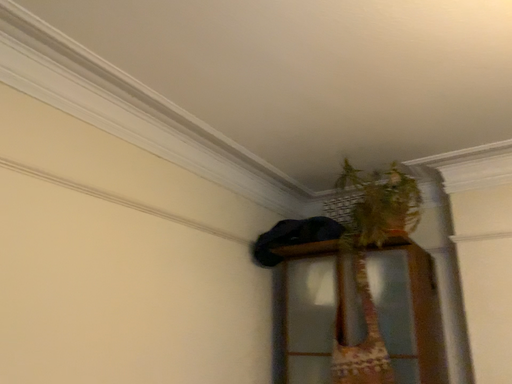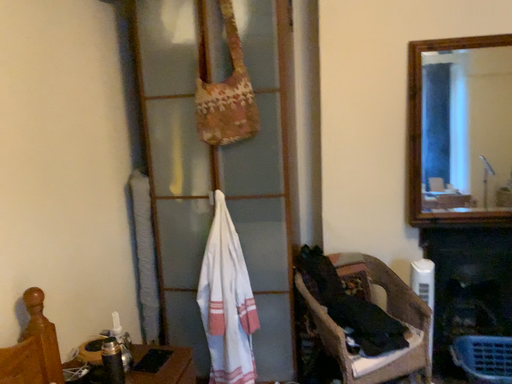
Question: How did the camera likely rotate when shooting the video?

Choices:
 (A) rotated left
 (B) rotated right

Answer: (B)